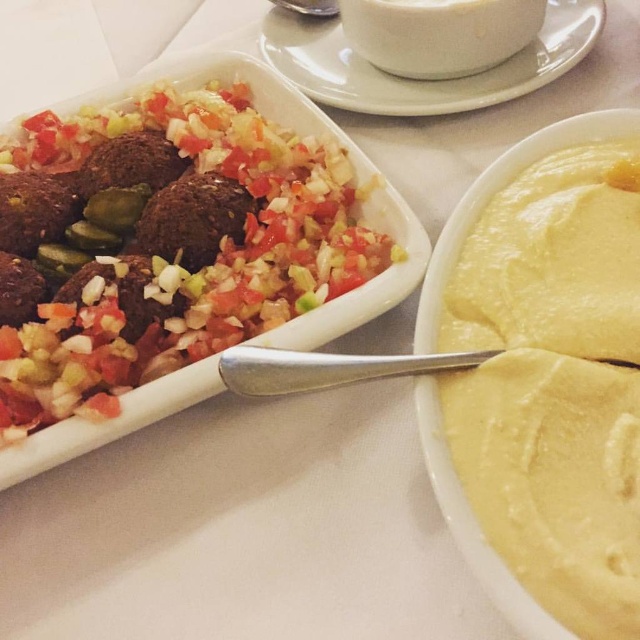
Is matte brown meatballs at left positioned behind white ceramic cup at upper center?

That is False.

Is point (138, 360) farther from camera compared to point (310, 84)?

No.

Is point (86, 166) positioned in front of point (538, 67)?

Yes, it is in front of point (538, 67).

Locate an element on the screen. matte brown meatballs at left is located at coordinates (172, 250).

Based on the photo, which of these two, matte brown meatballs at left or yellow smooth hummus at right, stands shorter?

yellow smooth hummus at right is shorter.

Is matte brown meatballs at left smaller than yellow smooth hummus at right?

No.

Which is in front, point (26, 390) or point (499, 531)?

Positioned in front is point (499, 531).

Where is `matte brown meatballs at left`? The width and height of the screenshot is (640, 640). matte brown meatballs at left is located at coordinates (172, 250).

Does point (611, 545) come in front of point (577, 44)?

Yes, it is in front of point (577, 44).

Between point (600, 417) and point (321, 42), which one is positioned behind?

The point (321, 42) is behind.

Is point (454, 419) closer to camera compared to point (504, 90)?

Yes, it is.

You are a GUI agent. You are given a task and a screenshot of the screen. Output one action in this format:
    pyautogui.click(x=<x>, y=<y>)
    Task: Click on the yellow smooth hummus at right
    
    Given the screenshot: What is the action you would take?
    pyautogui.click(x=554, y=384)